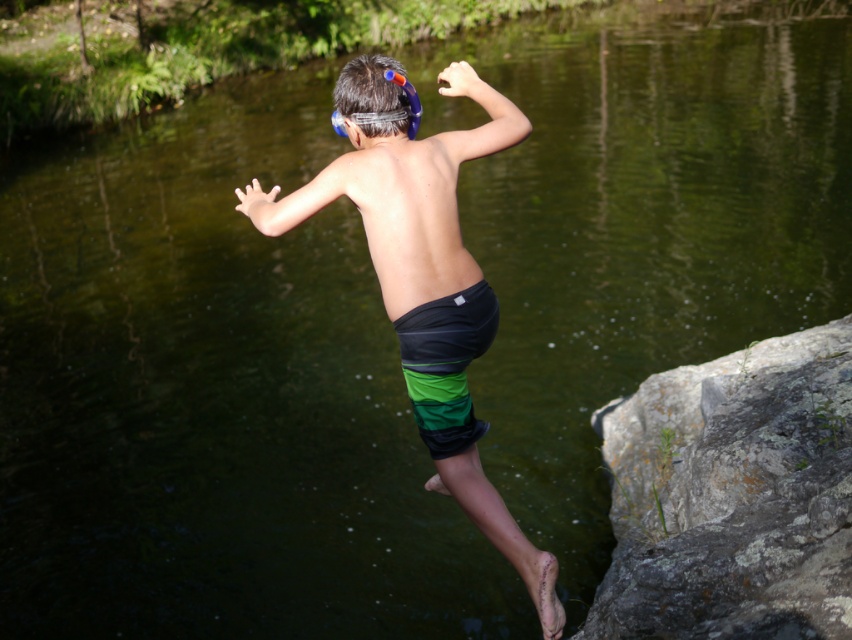
The scene shows a boy jumping into water. He has two items of clothing visible at the center of the image. Which clothing item is positioned lower on his body between the multicolored swim trunks at center and the green striped shorts at center?

The multicolored swim trunks at center is positioned lower on his body than the green striped shorts at center.